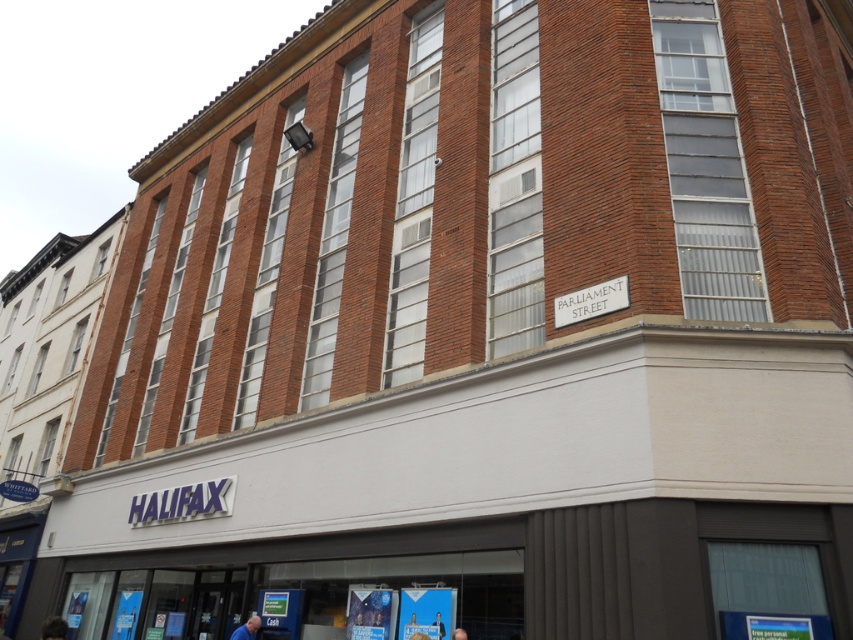
Question: Which point appears farthest from the camera in this image?

Choices:
 (A) (259, 620)
 (B) (427, 636)
 (C) (463, 632)
 (D) (65, 627)

Answer: (A)

Question: Which point is closer to the camera?

Choices:
 (A) (463, 637)
 (B) (47, 618)
 (C) (419, 636)

Answer: (A)

Question: Can you confirm if brown hair at lower left is positioned to the right of blue fabric person at lower center?

Choices:
 (A) no
 (B) yes

Answer: (A)

Question: Does blue fabric at lower center come in front of blue fabric person at lower center?

Choices:
 (A) no
 (B) yes

Answer: (A)

Question: Which of the following is the closest to the observer?

Choices:
 (A) (57, 616)
 (B) (248, 625)
 (C) (421, 637)

Answer: (C)

Question: Is brown hair at lower left closer to camera compared to blue fabric head at center?

Choices:
 (A) no
 (B) yes

Answer: (A)